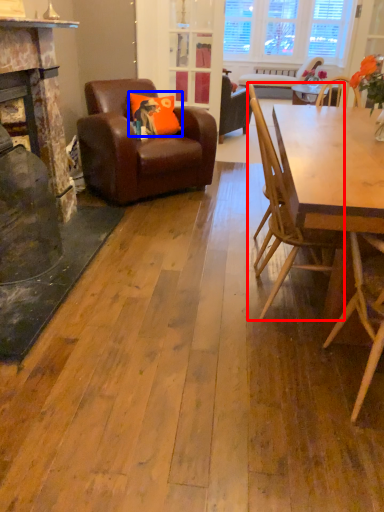
Question: Which object is closer to the camera taking this photo, chair (highlighted by a red box) or pillow (highlighted by a blue box)?

Choices:
 (A) chair
 (B) pillow

Answer: (A)